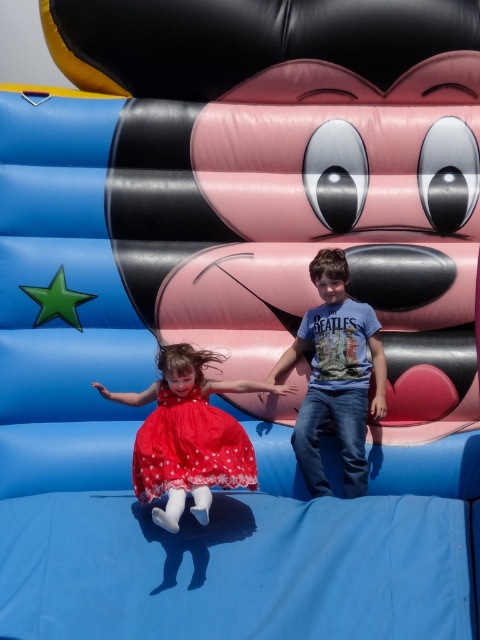
The image size is (480, 640). What are the coordinates of `blue t-shirt at center` in the screenshot? It's located at (336, 376).

Can you confirm if blue t-shirt at center is positioned to the right of red satin dress at lower left?

Yes, blue t-shirt at center is to the right of red satin dress at lower left.

The height and width of the screenshot is (640, 480). What are the coordinates of `blue t-shirt at center` in the screenshot? It's located at (336, 376).

Where is `blue t-shirt at center`? blue t-shirt at center is located at coordinates (336, 376).

Which is above, red polka dot dress at lower left or red satin dress at lower left?

Result: red satin dress at lower left

Which is more to the right, red polka dot dress at lower left or red satin dress at lower left?

red polka dot dress at lower left is more to the right.

Who is more forward, (238, 442) or (152, 465)?

Point (152, 465)

This screenshot has width=480, height=640. Identify the location of red polka dot dress at lower left. (189, 435).

Is red polka dot dress at lower left to the left of blue t-shirt at center from the viewer's perspective?

Indeed, red polka dot dress at lower left is positioned on the left side of blue t-shirt at center.

Between red polka dot dress at lower left and blue t-shirt at center, which one appears on the right side from the viewer's perspective?

From the viewer's perspective, blue t-shirt at center appears more on the right side.

Which is behind, point (250, 480) or point (274, 369)?

The point (274, 369) is behind.

You are a GUI agent. You are given a task and a screenshot of the screen. Output one action in this format:
    pyautogui.click(x=<x>, y=<y>)
    Task: Click on the red polka dot dress at lower left
    The image size is (480, 640).
    Given the screenshot: What is the action you would take?
    pyautogui.click(x=189, y=435)